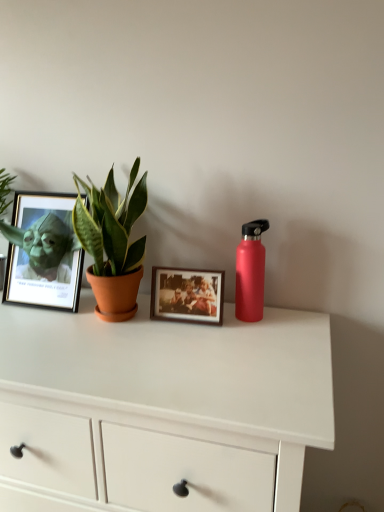
Question: Is matte black frame at left, the second picture frame in the right-to-left sequence, positioned far away from white matte chest of drawers at center?

Choices:
 (A) yes
 (B) no

Answer: (B)

Question: Would you say matte black frame at left, which is the 1th picture frame from left to right, contains white matte chest of drawers at center?

Choices:
 (A) no
 (B) yes

Answer: (A)

Question: Is matte black frame at left, the second picture frame in the right-to-left sequence, positioned beyond the bounds of white matte chest of drawers at center?

Choices:
 (A) no
 (B) yes

Answer: (B)

Question: Does matte black frame at left, the second picture frame in the right-to-left sequence, lie in front of white matte chest of drawers at center?

Choices:
 (A) yes
 (B) no

Answer: (B)

Question: Can you confirm if matte black frame at left, which is the 1th picture frame from left to right, is thinner than white matte chest of drawers at center?

Choices:
 (A) no
 (B) yes

Answer: (B)

Question: From a real-world perspective, relative to matte black frame at left, the second picture frame in the right-to-left sequence, is wooden photo frame at center, acting as the 1th picture frame starting from the right, vertically above or below?

Choices:
 (A) below
 (B) above

Answer: (A)

Question: In terms of height, does wooden photo frame at center, acting as the 1th picture frame starting from the right, look taller or shorter compared to matte black frame at left, which is the 1th picture frame from left to right?

Choices:
 (A) short
 (B) tall

Answer: (A)

Question: In terms of width, does wooden photo frame at center, acting as the 1th picture frame starting from the right, look wider or thinner when compared to matte black frame at left, the second picture frame in the right-to-left sequence?

Choices:
 (A) wide
 (B) thin

Answer: (B)

Question: Is wooden photo frame at center, which ranks as the 2th picture frame in left-to-right order, in front of or behind matte black frame at left, the second picture frame in the right-to-left sequence, in the image?

Choices:
 (A) behind
 (B) front

Answer: (B)

Question: Visually, is wooden photo frame at center, which ranks as the 2th picture frame in left-to-right order, positioned to the left or to the right of matte red water bottle at right?

Choices:
 (A) left
 (B) right

Answer: (A)

Question: In terms of width, does wooden photo frame at center, which ranks as the 2th picture frame in left-to-right order, look wider or thinner when compared to matte red water bottle at right?

Choices:
 (A) wide
 (B) thin

Answer: (A)

Question: From the image's perspective, is wooden photo frame at center, which ranks as the 2th picture frame in left-to-right order, above or below matte red water bottle at right?

Choices:
 (A) above
 (B) below

Answer: (B)

Question: Considering the positions of point (195, 287) and point (236, 307), is point (195, 287) closer or farther from the camera than point (236, 307)?

Choices:
 (A) closer
 (B) farther

Answer: (A)

Question: Looking at their shapes, would you say matte black frame at left, which is the 1th picture frame from left to right, is wider or thinner than white matte chest of drawers at center?

Choices:
 (A) wide
 (B) thin

Answer: (B)

Question: Is matte black frame at left, the second picture frame in the right-to-left sequence, inside the boundaries of white matte chest of drawers at center, or outside?

Choices:
 (A) outside
 (B) inside

Answer: (A)